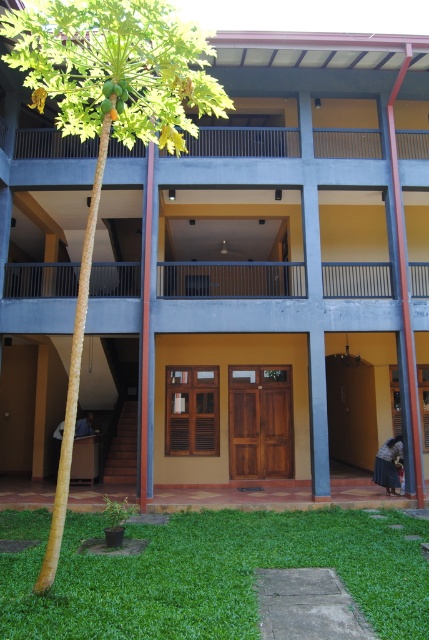
You are standing on the paved pathway in front of the building. You notice the green grass at lower center and the green leafy tree at upper left. Which of these two has a greater height?

The green leafy tree at upper left has a greater height than the green grass at lower center.

You are standing in front of the building and see two points marked on the ground. The first point is at coordinate point (103,593) and the second is at point (99,42). Which point is closer to you?

Point (103,593) is closer to the camera than point (99,42), so the first point is closer to you.